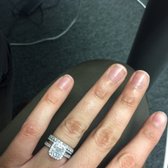
Find the location of a particular element. Image resolution: width=168 pixels, height=168 pixels. chair arm is located at coordinates coord(8,62).